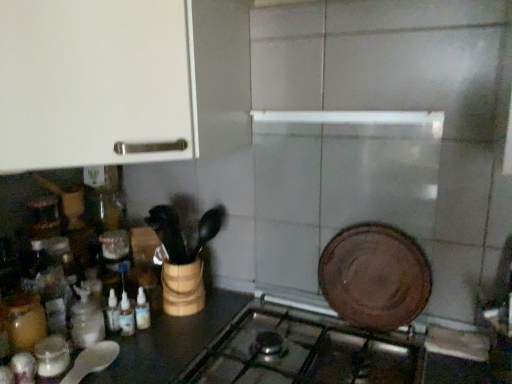
Question: Does translucent glass bottles at lower left, the 1th bottle viewed from the right, appear on the right side of white matte cabinet at upper left?

Choices:
 (A) no
 (B) yes

Answer: (B)

Question: Does translucent glass bottles at lower left, acting as the third bottle starting from the left, have a greater height compared to white matte cabinet at upper left?

Choices:
 (A) no
 (B) yes

Answer: (A)

Question: Is translucent glass bottles at lower left, acting as the third bottle starting from the left, outside of white matte cabinet at upper left?

Choices:
 (A) no
 (B) yes

Answer: (B)

Question: Is translucent glass bottles at lower left, acting as the third bottle starting from the left, bigger than white matte cabinet at upper left?

Choices:
 (A) no
 (B) yes

Answer: (A)

Question: Is the position of translucent glass bottles at lower left, the 1th bottle viewed from the right, more distant than that of white matte cabinet at upper left?

Choices:
 (A) no
 (B) yes

Answer: (B)

Question: Considering the relative sizes of translucent glass bottles at lower left, acting as the third bottle starting from the left, and white matte cabinet at upper left in the image provided, is translucent glass bottles at lower left, acting as the third bottle starting from the left, thinner than white matte cabinet at upper left?

Choices:
 (A) no
 (B) yes

Answer: (B)

Question: From the image's perspective, is translucent glass jar at left, which appears as the 1th bottle when viewed from the left, below white matte cabinet at upper left?

Choices:
 (A) yes
 (B) no

Answer: (A)

Question: Can you confirm if translucent glass jar at left, which appears as the 1th bottle when viewed from the left, is shorter than white matte cabinet at upper left?

Choices:
 (A) no
 (B) yes

Answer: (B)

Question: Does translucent glass jar at left, marked as the 3th bottle in a right-to-left arrangement, have a greater height compared to white matte cabinet at upper left?

Choices:
 (A) no
 (B) yes

Answer: (A)

Question: Would you say translucent glass jar at left, which appears as the 1th bottle when viewed from the left, contains white matte cabinet at upper left?

Choices:
 (A) no
 (B) yes

Answer: (A)

Question: Considering the relative positions of translucent glass jar at left, marked as the 3th bottle in a right-to-left arrangement, and white matte cabinet at upper left in the image provided, is translucent glass jar at left, marked as the 3th bottle in a right-to-left arrangement, in front of white matte cabinet at upper left?

Choices:
 (A) no
 (B) yes

Answer: (A)

Question: From a real-world perspective, is translucent glass jar at left, marked as the 3th bottle in a right-to-left arrangement, under white matte cabinet at upper left?

Choices:
 (A) no
 (B) yes

Answer: (B)

Question: Is translucent glass bottle at lower left, which ranks as the 2th bottle in left-to-right order, completely or partially outside of white matte cabinet at upper left?

Choices:
 (A) no
 (B) yes

Answer: (B)